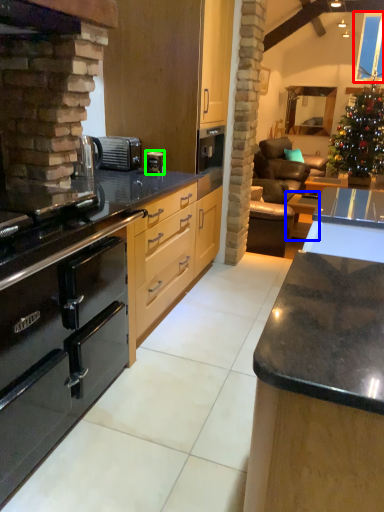
Question: Which is nearer to the window screen (highlighted by a red box)? table (highlighted by a blue box) or coffee machine (highlighted by a green box).

Choices:
 (A) table
 (B) coffee machine

Answer: (A)